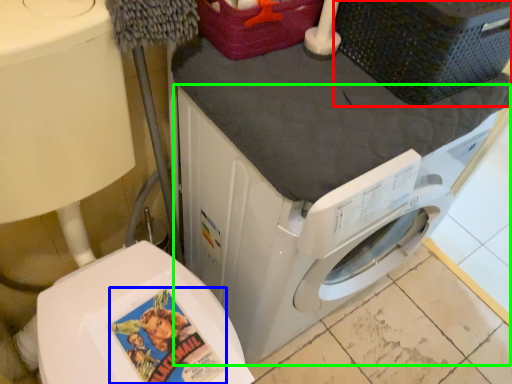
Question: Considering the real-world distances, which object is closest to basket (highlighted by a red box)? comic book character (highlighted by a blue box) or washing machine (highlighted by a green box).

Choices:
 (A) comic book character
 (B) washing machine

Answer: (B)